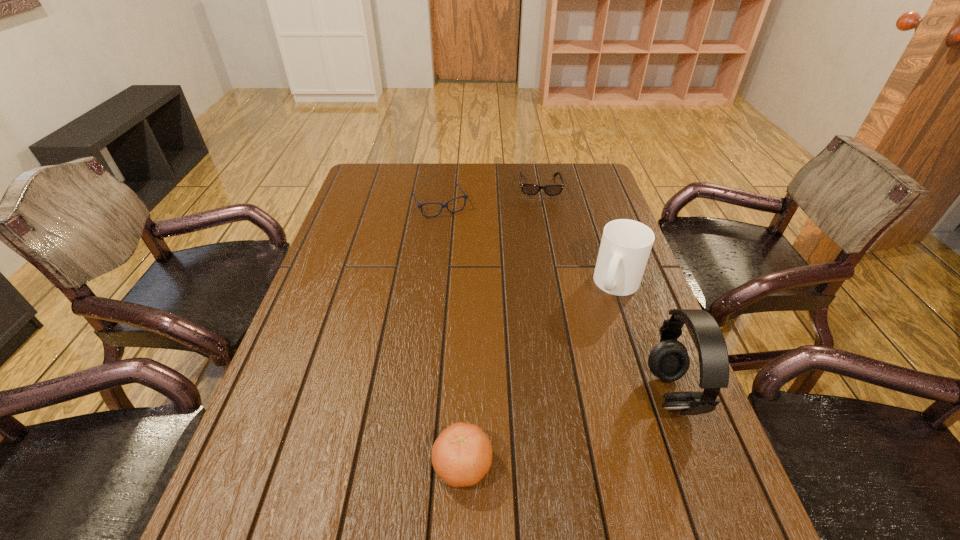
Where is `clementine`? The image size is (960, 540). clementine is located at coordinates (462, 454).

Identify the location of the tallest object. This screenshot has width=960, height=540. pyautogui.click(x=669, y=361).

Image resolution: width=960 pixels, height=540 pixels. I want to click on mug, so click(x=625, y=247).

Locate an element on the screen. The image size is (960, 540). the third farthest object is located at coordinates (625, 247).

The width and height of the screenshot is (960, 540). I want to click on the third object from left to right, so click(x=528, y=189).

Where is `the left spectacles`? Image resolution: width=960 pixels, height=540 pixels. the left spectacles is located at coordinates (464, 196).

Identify the location of vacant area situated on the right of the clementine. The image size is (960, 540). (577, 465).

I want to click on vacant space located 0.220m on the handle side of the third farthest object, so click(600, 367).

I want to click on free spot located 0.320m on the handle side of the third farthest object, so click(x=591, y=403).

I want to click on vacant region located on the handle side of the third farthest object, so (601, 364).